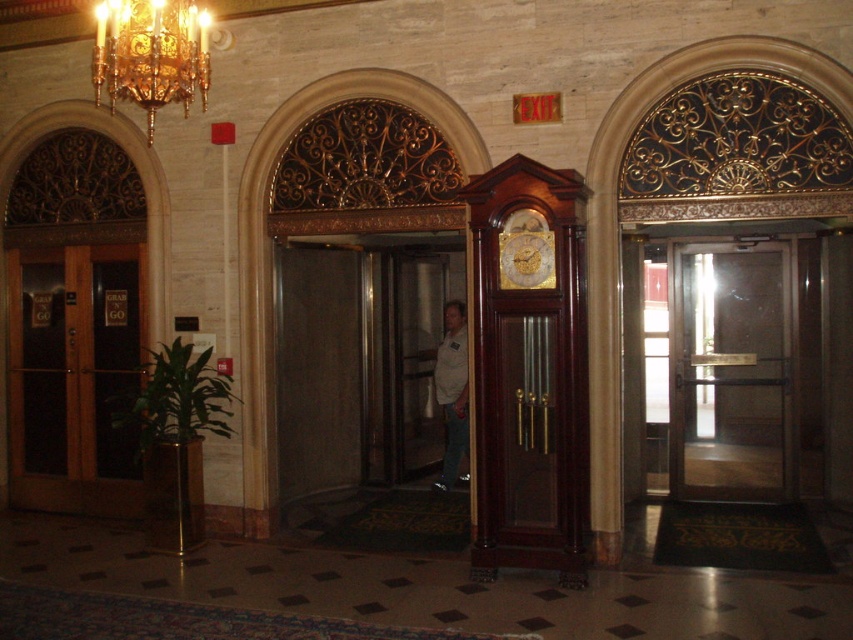
Image resolution: width=853 pixels, height=640 pixels. I want to click on transparent glass door at right, so click(730, 376).

Which is below, transparent glass door at right or gold crystal chandelier at upper left?

transparent glass door at right

Which is in front, point (706, 369) or point (155, 6)?

Point (155, 6) is more forward.

Identify the location of transparent glass door at right. (730, 376).

Who is shorter, brown wooden door at left or transparent glass door at right?

transparent glass door at right is shorter.

Between point (126, 256) and point (704, 413), which one is positioned in front?

Point (126, 256) is in front.

This screenshot has height=640, width=853. I want to click on brown wooden door at left, so click(74, 378).

In the scene shown: Is brown wooden door at left to the right of light brown leather jacket at center from the viewer's perspective?

In fact, brown wooden door at left is to the left of light brown leather jacket at center.

Who is higher up, brown wooden door at left or light brown leather jacket at center?

Positioned higher is brown wooden door at left.

Is point (61, 392) more distant than point (445, 417)?

No, it is in front of (445, 417).

The width and height of the screenshot is (853, 640). What are the coordinates of `brown wooden door at left` in the screenshot? It's located at (74, 378).